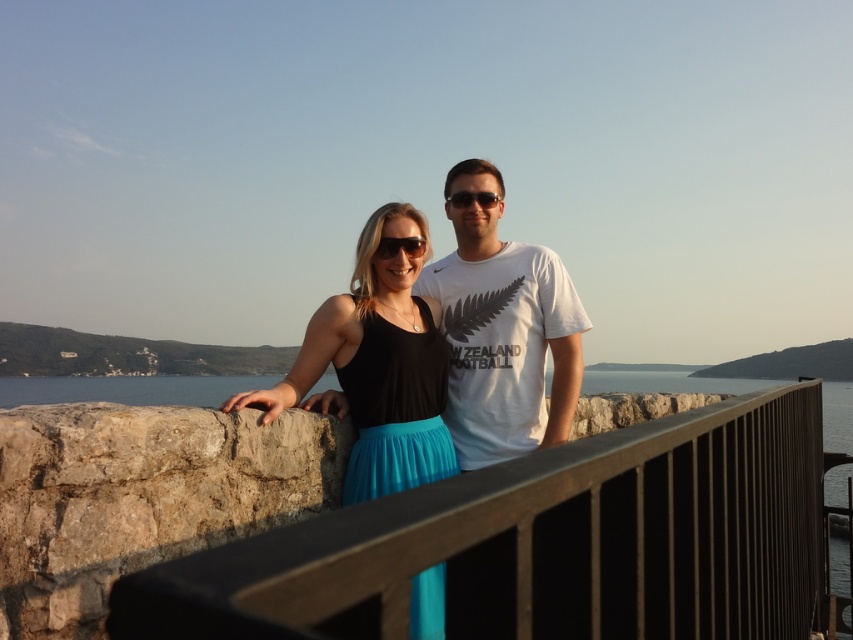
Question: Which object is closer to the camera taking this photo?

Choices:
 (A) black matte tank top at center
 (B) matte black sunglasses at center
 (C) black plastic sunglasses at center

Answer: (A)

Question: Which object appears farthest from the camera in this image?

Choices:
 (A) white cotton t-shirt at center
 (B) black plastic sunglasses at center

Answer: (B)

Question: Is matte black sunglasses at center to the right of black plastic sunglasses at center from the viewer's perspective?

Choices:
 (A) no
 (B) yes

Answer: (A)

Question: Does brown wooden rail at center have a smaller size compared to matte black sunglasses at center?

Choices:
 (A) no
 (B) yes

Answer: (A)

Question: Which point is farther from the camera taking this photo?

Choices:
 (A) (584, 547)
 (B) (518, 388)
 (C) (419, 252)

Answer: (B)

Question: Is matte black sunglasses at center above black plastic sunglasses at center?

Choices:
 (A) no
 (B) yes

Answer: (A)